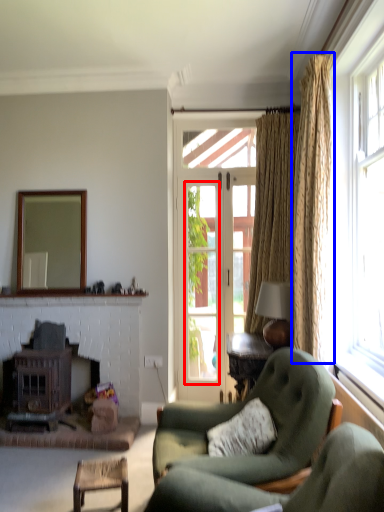
Question: Which point is closer to the camera, window screen (highlighted by a red box) or curtain (highlighted by a blue box)?

Choices:
 (A) window screen
 (B) curtain

Answer: (B)